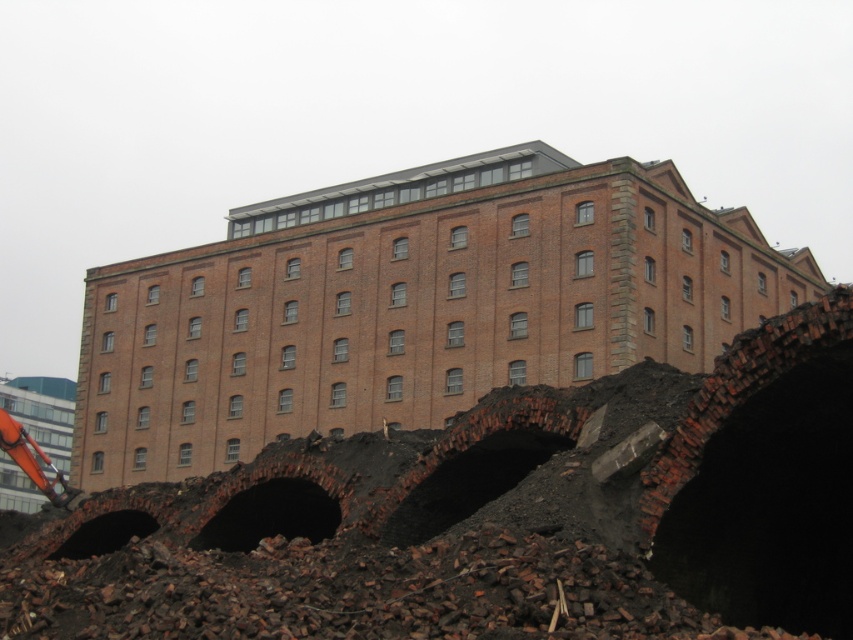
You are a construction worker who needs to locate the exposed brick rubble at center. According to the coordinates provided, where exactly would you find it in the image?

The exposed brick rubble at center is located at point coordinates (410, 305).

Based on the photo, you are a construction worker assessing the site. You notice the exposed brick rubble at center and the dark brick hole at center. Which one is taller?

The exposed brick rubble at center is taller than the dark brick hole at center.

You are an architect inspecting the construction site of the multi story brick building. You need to place a temporary support beam that must be wider than the dark brick hole at center. Can the exposed brick rubble at center be used as a base for this beam?

The exposed brick rubble at center has a width larger than the dark brick hole at center, so yes, it can be used as a base for the temporary support beam since its width exceeds the required minimum.